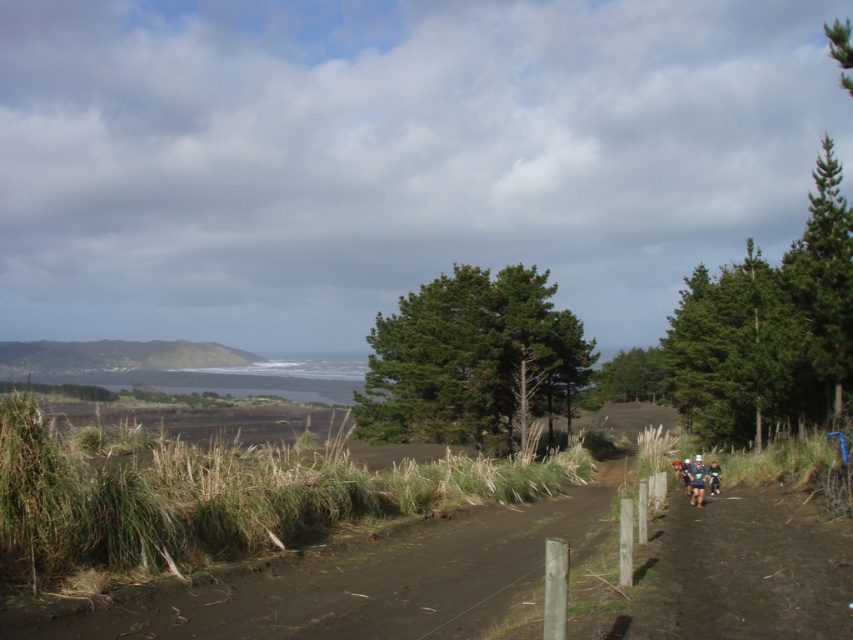
You are standing at the starting point of the dirt path in the coastal landscape. You see two points marked on the path ahead. The first point is at coordinates point (24, 353) and the second is at point (703, 474). Which point is closer to you as you walk along the path?

Point (703, 474) is closer to you because point (24, 353) is behind it.